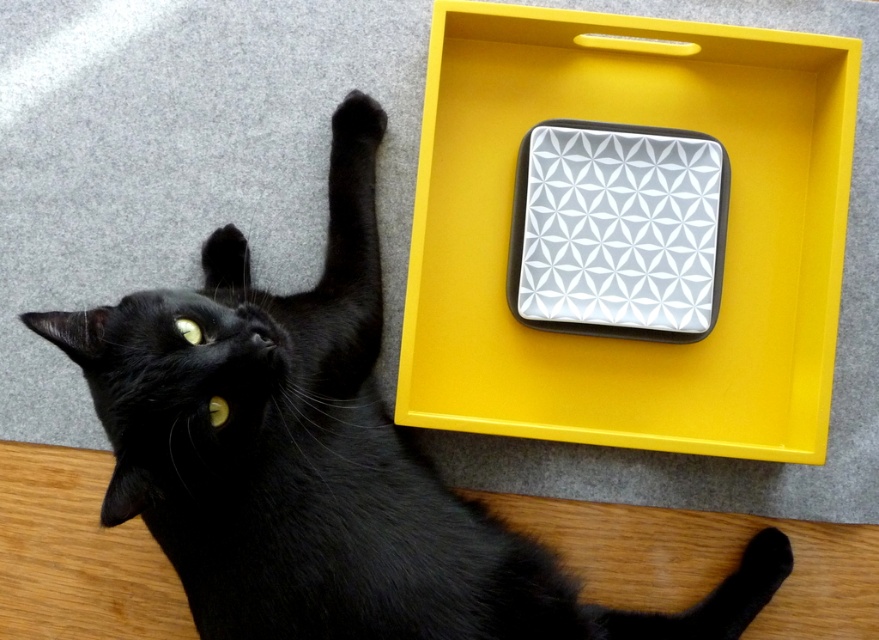
Question: Considering the real-world distances, which object is closest to the yellow matte tray at upper right?

Choices:
 (A) black fur paw at upper left
 (B) white glossy square at center

Answer: (B)

Question: Which object is positioned farthest from the yellow matte tray at upper right?

Choices:
 (A) black fur paw at upper left
 (B) white glossy square at center

Answer: (A)

Question: Does white glossy square at center lie behind black fur paw at upper left?

Choices:
 (A) no
 (B) yes

Answer: (A)

Question: Does yellow matte tray at upper right lie in front of white glossy square at center?

Choices:
 (A) no
 (B) yes

Answer: (B)

Question: Which point is farther to the camera?

Choices:
 (A) white glossy square at center
 (B) yellow matte tray at upper right

Answer: (A)

Question: Does white glossy square at center appear on the left side of black fur paw at upper left?

Choices:
 (A) no
 (B) yes

Answer: (A)